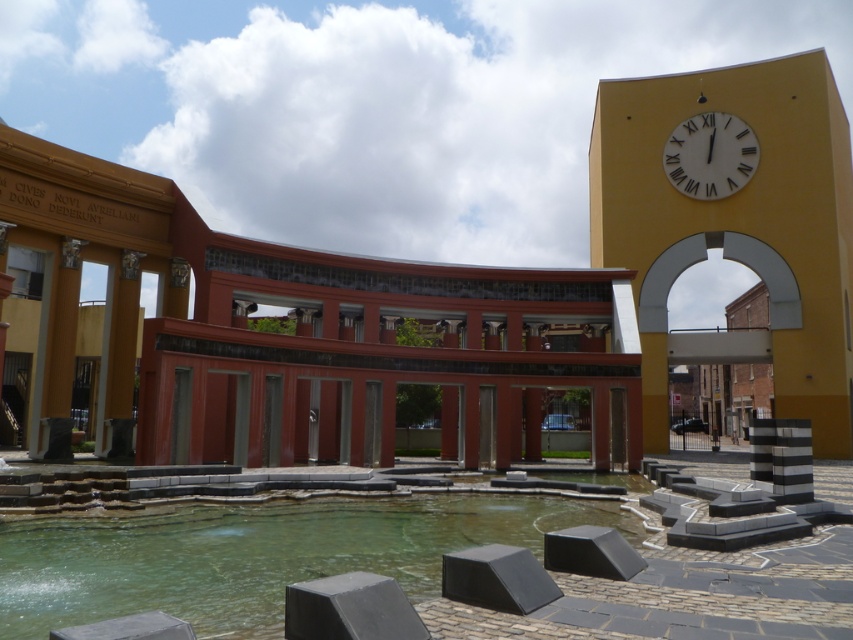
Question: Is clear glass water at center wider than matte yellow archway at center?

Choices:
 (A) yes
 (B) no

Answer: (A)

Question: Estimate the real-world distances between objects in this image. Which object is closer to the white matte clock at upper right?

Choices:
 (A) yellow matte clock tower at upper right
 (B) clear glass water at center
 (C) matte yellow archway at center

Answer: (A)

Question: Does matte yellow archway at center appear on the right side of white matte clock at upper right?

Choices:
 (A) yes
 (B) no

Answer: (B)

Question: Which is farther from the clear glass water at center?

Choices:
 (A) yellow matte clock tower at upper right
 (B) matte yellow archway at center

Answer: (B)

Question: Can you confirm if clear glass water at center is bigger than white matte clock at upper right?

Choices:
 (A) no
 (B) yes

Answer: (B)

Question: Which point is closer to the camera?

Choices:
 (A) yellow matte clock tower at upper right
 (B) clear glass water at center
 (C) matte yellow archway at center
 (D) white matte clock at upper right

Answer: (B)